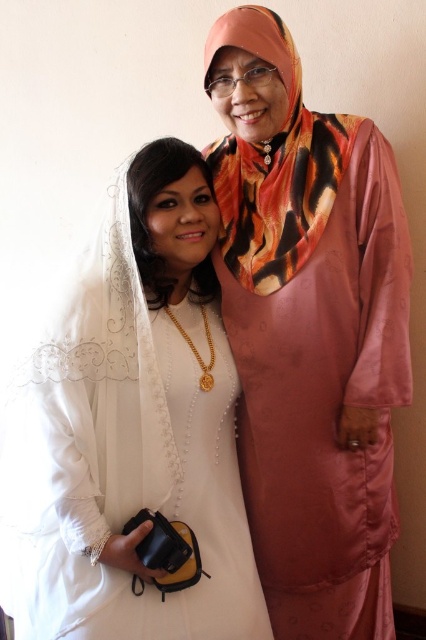
You are a photographer standing at the point marked as point [296,104]. You need to capture a photo of both individuals so that they appear in the frame without any part of them being cut off. Given their current positions, what is the minimum distance you should maintain from them to ensure both are fully visible?

The minimum distance you should maintain is 5.25 feet to ensure both individuals are fully visible in the frame without any part being cut off, as they are currently 5.25 feet apart.